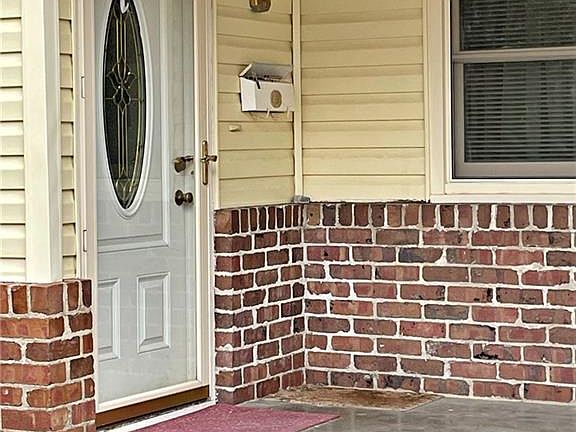
Locate an element on the screen. The height and width of the screenshot is (432, 576). sconce is located at coordinates coord(259,5).